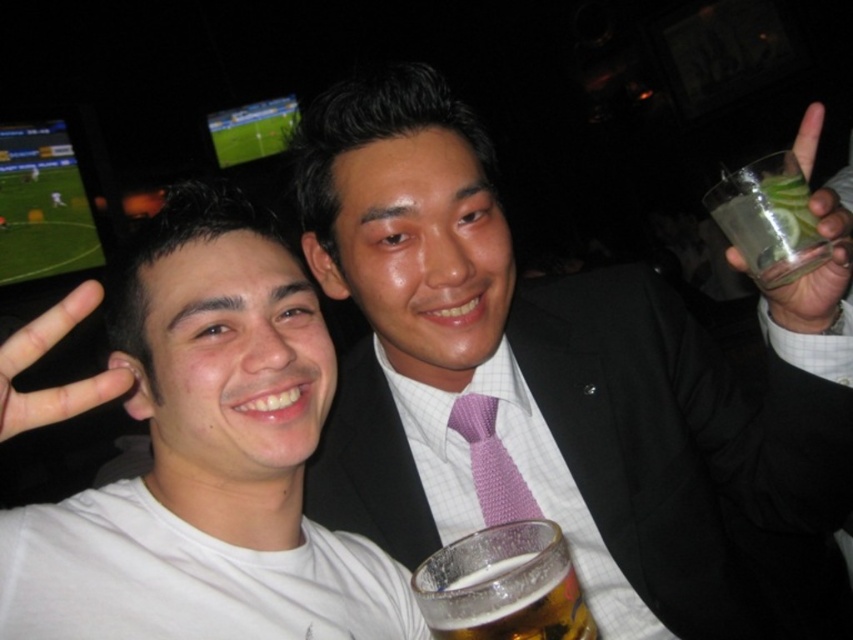
Find the location of a particular element. translucent glass beer at center is located at coordinates (503, 586).

Which is more to the left, white matte hand at left or purple knitted tie at center?

Positioned to the left is white matte hand at left.

Does white matte hand at left have a larger size compared to purple knitted tie at center?

Yes.

This screenshot has width=853, height=640. What do you see at coordinates (42, 355) in the screenshot?
I see `white matte hand at left` at bounding box center [42, 355].

Where is `white matte hand at left`? The width and height of the screenshot is (853, 640). white matte hand at left is located at coordinates (42, 355).

Between point (445, 346) and point (49, 611), which one is positioned behind?

The point (445, 346) is behind.

Does point (735, 484) come closer to viewer compared to point (409, 595)?

No, (735, 484) is further to viewer.

Locate an element on the screen. Image resolution: width=853 pixels, height=640 pixels. purple textured tie at center is located at coordinates (549, 388).